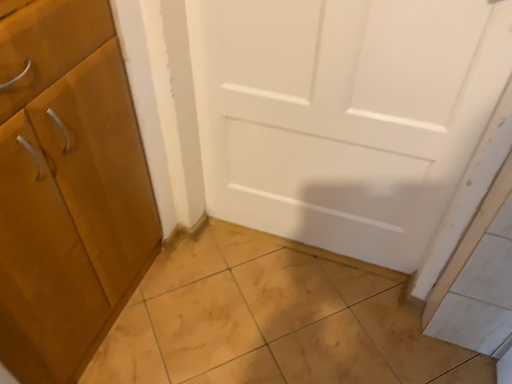
Measure the distance between point (147, 337) and camera.

Point (147, 337) and camera are 1.31 meters apart from each other.

This screenshot has width=512, height=384. Describe the element at coordinates (272, 321) in the screenshot. I see `light brown tile at lower left` at that location.

Where is `light brown tile at lower left`? The height and width of the screenshot is (384, 512). light brown tile at lower left is located at coordinates (272, 321).

The image size is (512, 384). Describe the element at coordinates (68, 187) in the screenshot. I see `matte wood cabinet at left` at that location.

Find the location of a particular element. The height and width of the screenshot is (384, 512). matte wood cabinet at left is located at coordinates (68, 187).

Locate an element on the screen. light brown tile at lower left is located at coordinates (272, 321).

From the picture: Which is more to the right, light brown tile at lower left or matte wood cabinet at left?

light brown tile at lower left.

Is the position of light brown tile at lower left less distant than that of matte wood cabinet at left?

That is False.

Which point is more forward, [253,338] or [117,285]?

The point [117,285] is more forward.

Consider the image. From the image's perspective, who appears lower, light brown tile at lower left or matte wood cabinet at left?

light brown tile at lower left is shown below in the image.

From a real-world perspective, which is physically above, light brown tile at lower left or matte wood cabinet at left?

matte wood cabinet at left is physically above.

Considering the sizes of light brown tile at lower left and matte wood cabinet at left in the image, is light brown tile at lower left wider or thinner than matte wood cabinet at left?

Considering their sizes, light brown tile at lower left looks broader than matte wood cabinet at left.

Can you confirm if light brown tile at lower left is taller than matte wood cabinet at left?

Incorrect, the height of light brown tile at lower left is not larger of that of matte wood cabinet at left.

Is light brown tile at lower left bigger than matte wood cabinet at left?

No, light brown tile at lower left is not bigger than matte wood cabinet at left.

Is light brown tile at lower left situated inside matte wood cabinet at left or outside?

light brown tile at lower left is not inside matte wood cabinet at left, it's outside.

Is light brown tile at lower left in contact with matte wood cabinet at left?

light brown tile at lower left and matte wood cabinet at left are not in contact.

Is light brown tile at lower left positioned with its back to matte wood cabinet at left?

That's not correct — light brown tile at lower left is not looking away from matte wood cabinet at left.

What's the angular difference between light brown tile at lower left and matte wood cabinet at left's facing directions?

The angular difference between light brown tile at lower left and matte wood cabinet at left is 89.2 degrees.

This screenshot has width=512, height=384. Identify the location of tile that is below the matte wood cabinet at left (from the image's perspective). (272, 321).

Is matte wood cabinet at left to the left of light brown tile at lower left from the viewer's perspective?

Yes, matte wood cabinet at left is to the left of light brown tile at lower left.

Is matte wood cabinet at left further to camera compared to light brown tile at lower left?

That is False.

Is point (121, 287) farther from viewer compared to point (129, 330)?

No.

In the scene shown: From the image's perspective, does matte wood cabinet at left appear lower than light brown tile at lower left?

Incorrect, from the image's perspective, matte wood cabinet at left is higher than light brown tile at lower left.

From a real-world perspective, which object rests below the other?

From a 3D spatial view, light brown tile at lower left is below.

Considering the sizes of matte wood cabinet at left and light brown tile at lower left in the image, is matte wood cabinet at left wider or thinner than light brown tile at lower left?

In the image, matte wood cabinet at left appears to be more narrow than light brown tile at lower left.

Can you confirm if matte wood cabinet at left is shorter than light brown tile at lower left?

No, matte wood cabinet at left is not shorter than light brown tile at lower left.

Does matte wood cabinet at left have a smaller size compared to light brown tile at lower left?

No, matte wood cabinet at left is not smaller than light brown tile at lower left.

Is matte wood cabinet at left outside of light brown tile at lower left?

Yes, matte wood cabinet at left is located beyond the bounds of light brown tile at lower left.

Is matte wood cabinet at left not close to light brown tile at lower left?

They are positioned close to each other.

Is matte wood cabinet at left positioned with its back to light brown tile at lower left?

No, matte wood cabinet at left is not facing the opposite direction of light brown tile at lower left.

Locate an element on the screen. tile below the matte wood cabinet at left (from the image's perspective) is located at coordinates pos(272,321).

The height and width of the screenshot is (384, 512). In order to click on tile below the matte wood cabinet at left (from a real-world perspective) in this screenshot , I will do `click(272, 321)`.

Where is `cabinetry in front of the light brown tile at lower left`? This screenshot has width=512, height=384. cabinetry in front of the light brown tile at lower left is located at coordinates (68, 187).